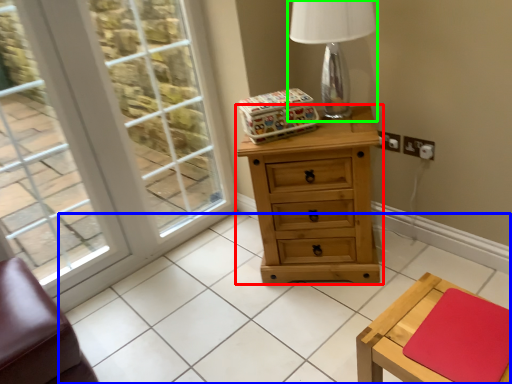
Question: Considering the real-world distances, which object is farthest from chest of drawers (highlighted by a red box)? tile (highlighted by a blue box) or table lamp (highlighted by a green box)?

Choices:
 (A) tile
 (B) table lamp

Answer: (A)